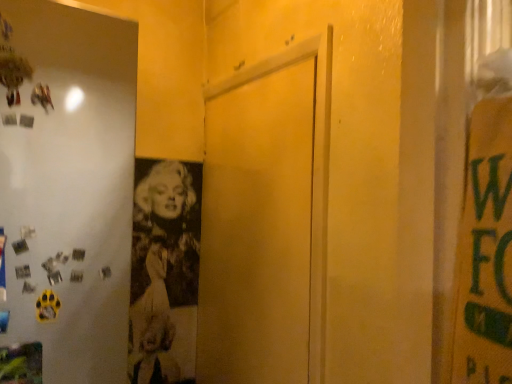
In order to face white glossy refrigerator at left, should I rotate leftwards or rightwards?

Rotate your view left by about 27.887°.

Find the location of a particular element. This screenshot has width=512, height=384. white glossy refrigerator at left is located at coordinates (65, 192).

What do you see at coordinates (65, 192) in the screenshot?
I see `white glossy refrigerator at left` at bounding box center [65, 192].

You are a GUI agent. You are given a task and a screenshot of the screen. Output one action in this format:
    pyautogui.click(x=<x>, y=<y>)
    Task: Click on the white glossy refrigerator at left
    This screenshot has height=384, width=512.
    Given the screenshot: What is the action you would take?
    tap(65, 192)